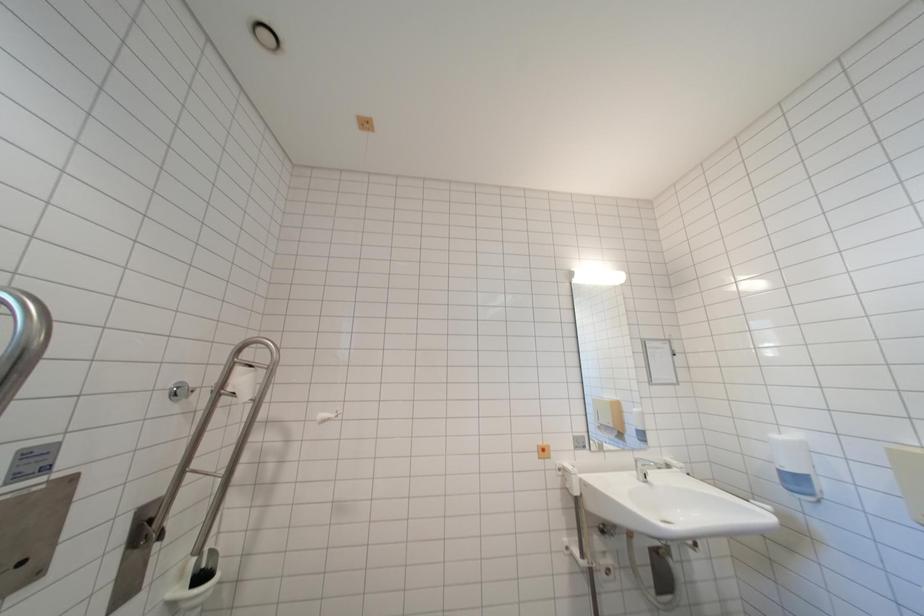
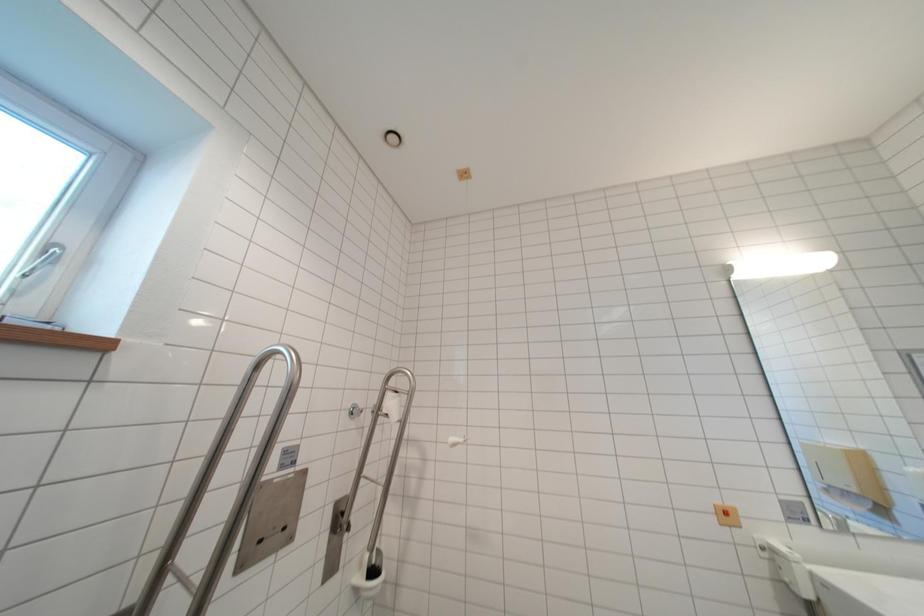
Question: The camera is either moving clockwise (left) or counter-clockwise (right) around the object. The first image is from the beginning of the video and the second image is from the end. Is the camera moving left or right when shooting the video?

Choices:
 (A) Left
 (B) Right

Answer: (B)